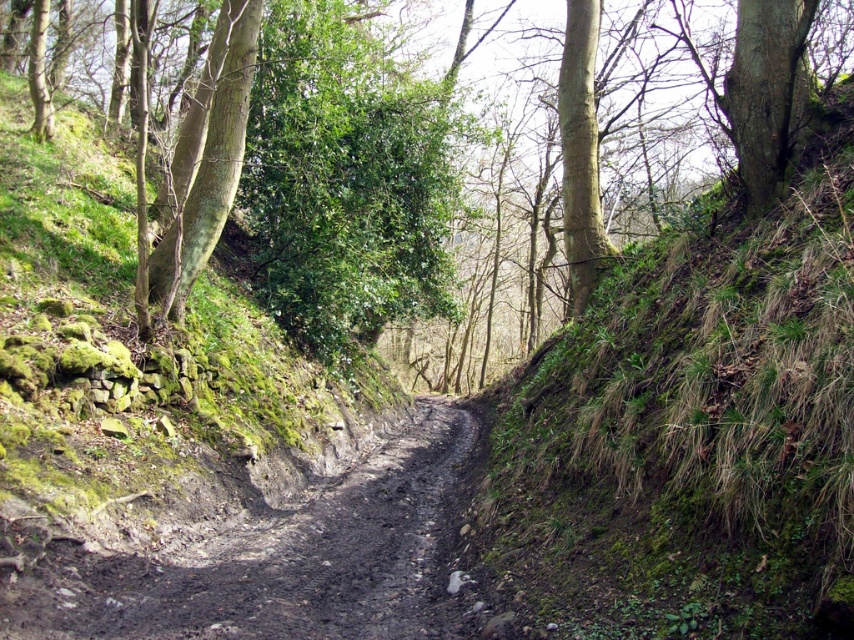
Is point (306, 236) closer to viewer compared to point (241, 582)?

No.

Locate an element on the screen. Image resolution: width=854 pixels, height=640 pixels. green leafy tree at center is located at coordinates (387, 182).

Does point (412, 600) come farther from viewer compared to point (229, 81)?

No, it is not.

How distant is dusty brown dirt track at center from green rough bark tree at left?

5.16 meters

You are a GUI agent. You are given a task and a screenshot of the screen. Output one action in this format:
    pyautogui.click(x=<x>, y=<y>)
    Task: Click on the dusty brown dirt track at center
    The height and width of the screenshot is (640, 854).
    Given the screenshot: What is the action you would take?
    pyautogui.click(x=279, y=561)

Who is positioned more to the left, green rough bark tree at left or smooth bark tree at upper center?

green rough bark tree at left is more to the left.

How distant is green rough bark tree at left from smooth bark tree at upper center?

green rough bark tree at left and smooth bark tree at upper center are 23.18 feet apart from each other.

Image resolution: width=854 pixels, height=640 pixels. Identify the location of green rough bark tree at left. (205, 157).

The image size is (854, 640). I want to click on green rough bark tree at left, so click(x=205, y=157).